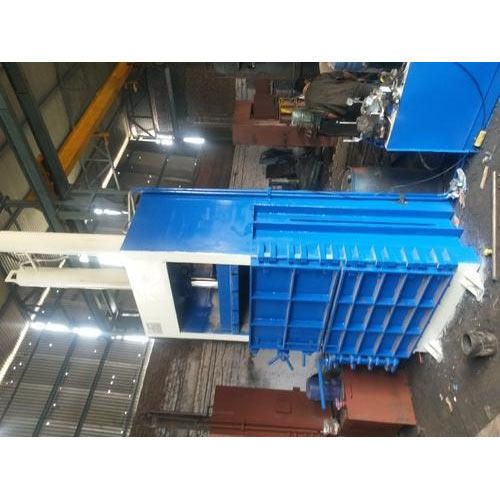
In order to click on white beam in this screenshot , I will do 58,243, 77,279.